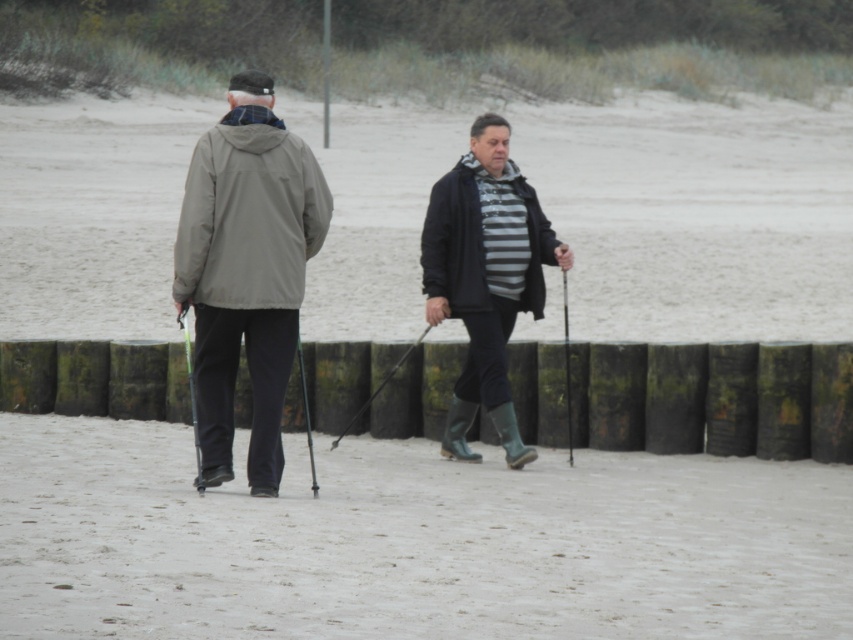
Question: Does striped fabric shirt at center have a larger size compared to smooth black ski pole at center?

Choices:
 (A) no
 (B) yes

Answer: (A)

Question: Which object is farther from the camera taking this photo?

Choices:
 (A) matte gray jacket at left
 (B) metallic pole at center
 (C) striped fabric shirt at center
 (D) smooth black ski pole at center

Answer: (B)

Question: Is white sand at lower center above metallic black ski pole at center?

Choices:
 (A) no
 (B) yes

Answer: (A)

Question: Which object is positioned farthest from the green plastic ski pole at left?

Choices:
 (A) metallic black ski pole at center
 (B) metallic pole at center
 (C) metallic silver ski pole at center

Answer: (B)

Question: Does white sand at lower center appear on the right side of matte gray jacket at center?

Choices:
 (A) yes
 (B) no

Answer: (A)

Question: Based on their relative distances, which object is farther from the metallic black ski pole at center?

Choices:
 (A) matte gray jacket at center
 (B) white sand at lower center

Answer: (B)